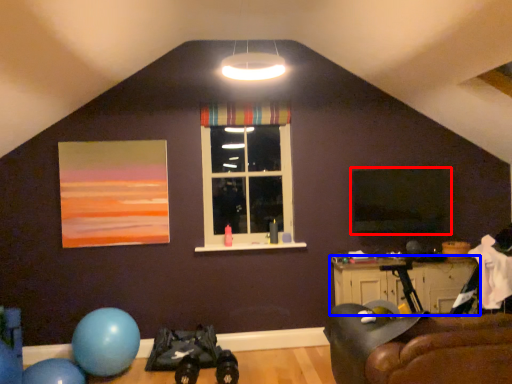
Question: Which of the following is the farthest to the observer, window screen (highlighted by a red box) or table (highlighted by a blue box)?

Choices:
 (A) window screen
 (B) table

Answer: (A)